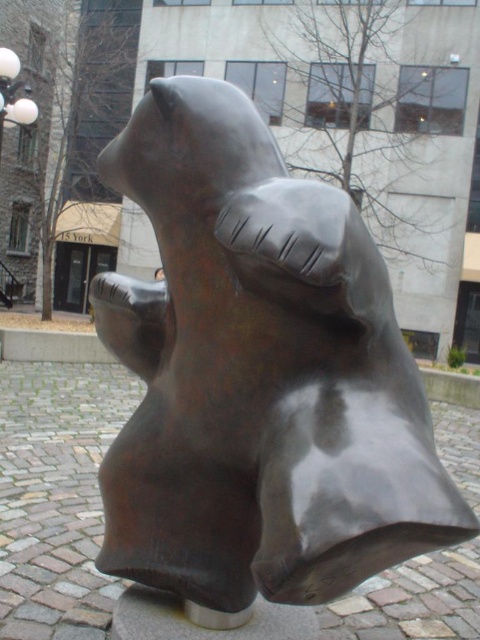
Question: Is bronze bear at center to the right of white glass lamp post at upper left from the viewer's perspective?

Choices:
 (A) yes
 (B) no

Answer: (A)

Question: Does bronze bear at center have a larger size compared to white glass lamp post at upper left?

Choices:
 (A) no
 (B) yes

Answer: (A)

Question: Which of the following is the closest to the observer?

Choices:
 (A) (307, 401)
 (B) (9, 76)

Answer: (A)

Question: Can you confirm if bronze bear at center is positioned to the right of white glass lamp post at upper left?

Choices:
 (A) no
 (B) yes

Answer: (B)